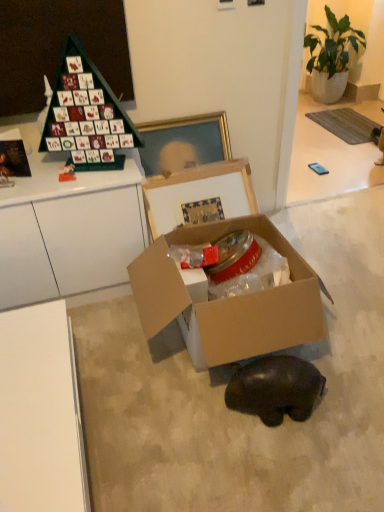
Question: Is cardboard box at center positioned before green matte advent calendar at upper left?

Choices:
 (A) yes
 (B) no

Answer: (A)

Question: From a real-world perspective, is cardboard box at center located beneath green matte advent calendar at upper left?

Choices:
 (A) yes
 (B) no

Answer: (A)

Question: Is the depth of cardboard box at center greater than that of green matte advent calendar at upper left?

Choices:
 (A) no
 (B) yes

Answer: (A)

Question: Is cardboard box at center taller than green matte advent calendar at upper left?

Choices:
 (A) yes
 (B) no

Answer: (B)

Question: From the image's perspective, is cardboard box at center beneath green matte advent calendar at upper left?

Choices:
 (A) yes
 (B) no

Answer: (A)

Question: Can you confirm if cardboard box at center is smaller than green matte advent calendar at upper left?

Choices:
 (A) yes
 (B) no

Answer: (B)

Question: From a real-world perspective, is black matte bear at lower center located higher than cardboard box at center?

Choices:
 (A) yes
 (B) no

Answer: (B)

Question: Is black matte bear at lower center to the left of cardboard box at center from the viewer's perspective?

Choices:
 (A) yes
 (B) no

Answer: (B)

Question: Considering the relative positions of black matte bear at lower center and cardboard box at center in the image provided, is black matte bear at lower center behind cardboard box at center?

Choices:
 (A) no
 (B) yes

Answer: (B)

Question: Can you confirm if black matte bear at lower center is thinner than cardboard box at center?

Choices:
 (A) no
 (B) yes

Answer: (B)

Question: Would you consider black matte bear at lower center to be distant from cardboard box at center?

Choices:
 (A) yes
 (B) no

Answer: (B)

Question: Is black matte bear at lower center smaller than cardboard box at center?

Choices:
 (A) no
 (B) yes

Answer: (B)

Question: From the image's perspective, does black matte bear at lower center appear higher than green matte advent calendar at upper left?

Choices:
 (A) no
 (B) yes

Answer: (A)